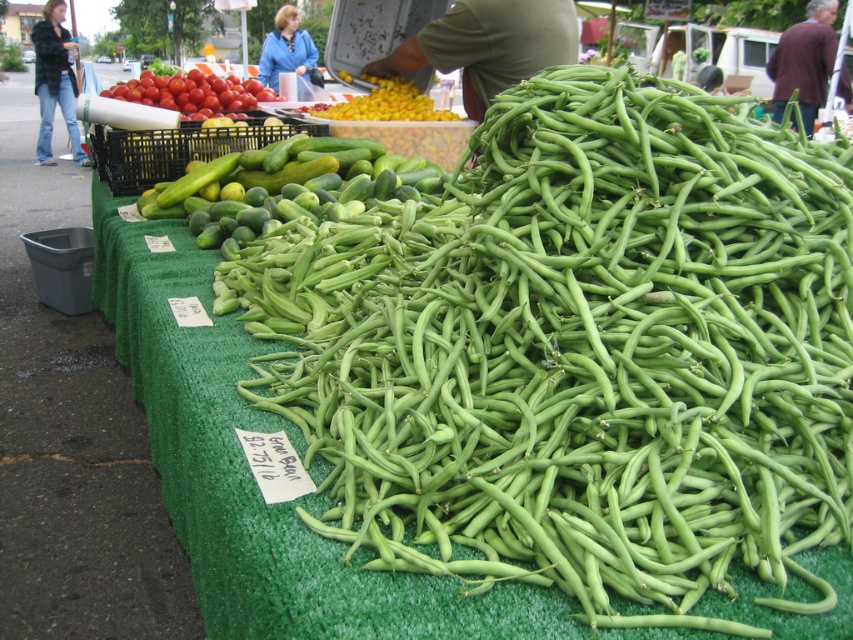
Is green smooth skin cucumber at center thinner than yellow corn at center?

No, green smooth skin cucumber at center is not thinner than yellow corn at center.

Is point (323, 186) positioned after point (425, 118)?

No, it is not.

Is point (386, 182) positioned in front of point (347, 80)?

Yes.

The height and width of the screenshot is (640, 853). Find the location of `green smooth skin cucumber at center`. green smooth skin cucumber at center is located at coordinates (287, 186).

Does shiny red tomatoes at upper left have a smaller size compared to yellow corn at center?

Correct, shiny red tomatoes at upper left occupies less space than yellow corn at center.

Between point (136, 97) and point (418, 118), which one is positioned in front?

Point (418, 118)

Which is behind, point (196, 108) or point (393, 120)?

The point (196, 108) is more distant.

This screenshot has width=853, height=640. I want to click on shiny red tomatoes at upper left, so pos(192,92).

Between green smooth beans at center and green smooth skin cucumber at center, which one has more height?

green smooth beans at center is taller.

Between point (822, 285) and point (194, 189), which one is positioned behind?

The point (194, 189) is behind.

Identify the location of green smooth beans at center. (581, 353).